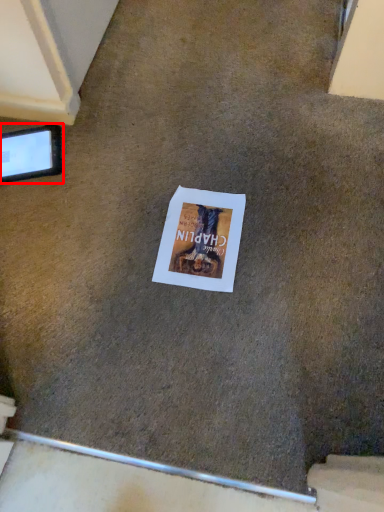
Question: From the image's perspective, considering the relative positions of tablet computer (annotated by the red box) and flyer in the image provided, where is tablet computer (annotated by the red box) located with respect to the staircase?

Choices:
 (A) above
 (B) below

Answer: (A)